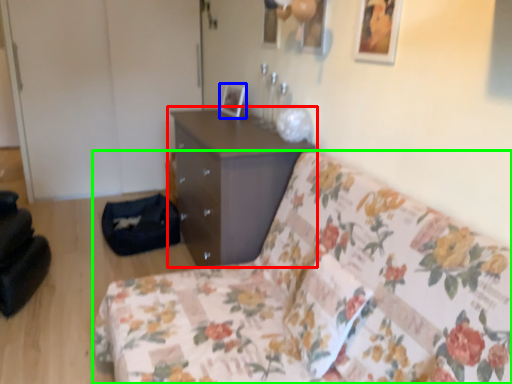
Question: Which object is positioned closest to chest of drawers (highlighted by a red box)? Select from picture frame (highlighted by a blue box) and studio couch (highlighted by a green box).

Choices:
 (A) picture frame
 (B) studio couch

Answer: (A)